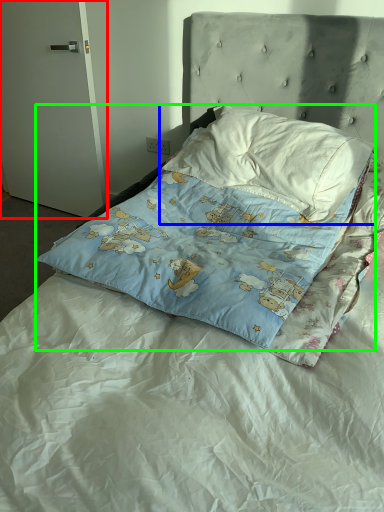
Question: Based on their relative distances, which object is nearer to door (highlighted by a red box)? Choose from pillow (highlighted by a blue box) and pillow (highlighted by a green box).

Choices:
 (A) pillow
 (B) pillow

Answer: (A)